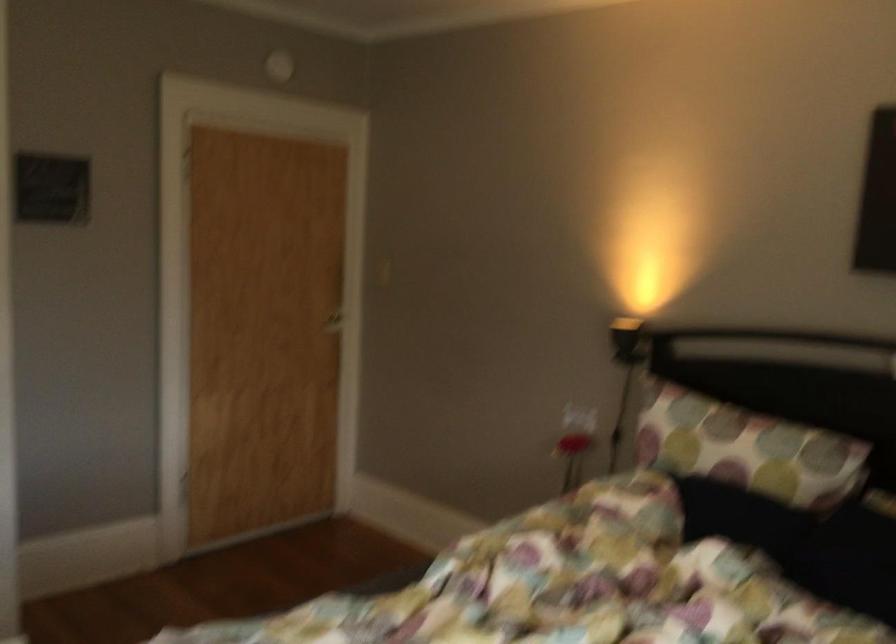
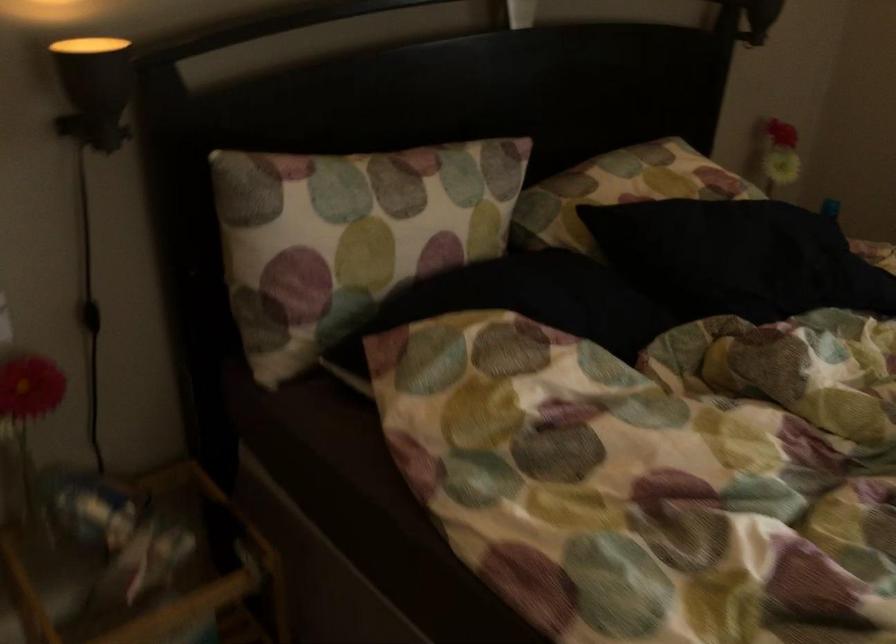
Locate, in the second image, the point that corresponds to (x=643, y=319) in the first image.

(90, 48)